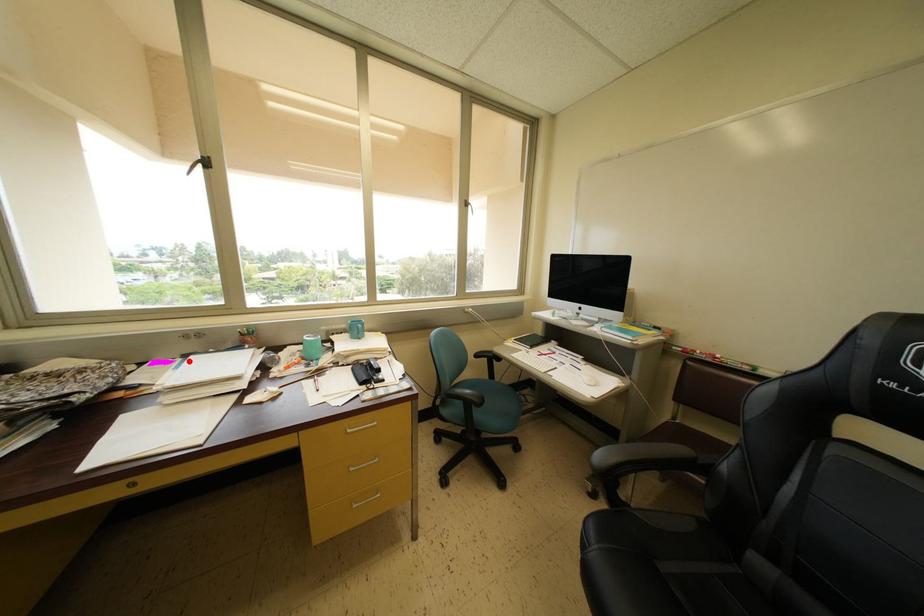
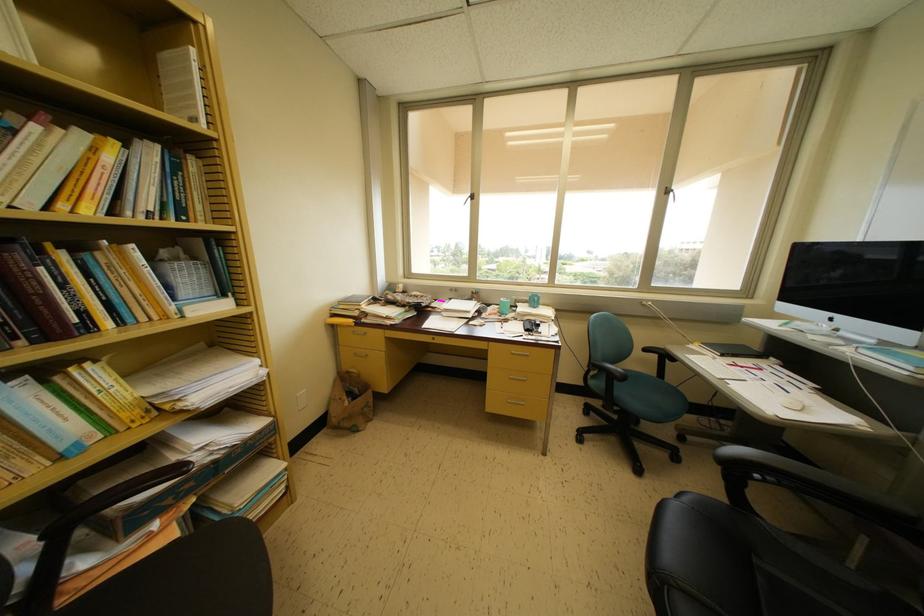
Find the pixel in the second image that matches the highlighted location in the first image.

(455, 304)